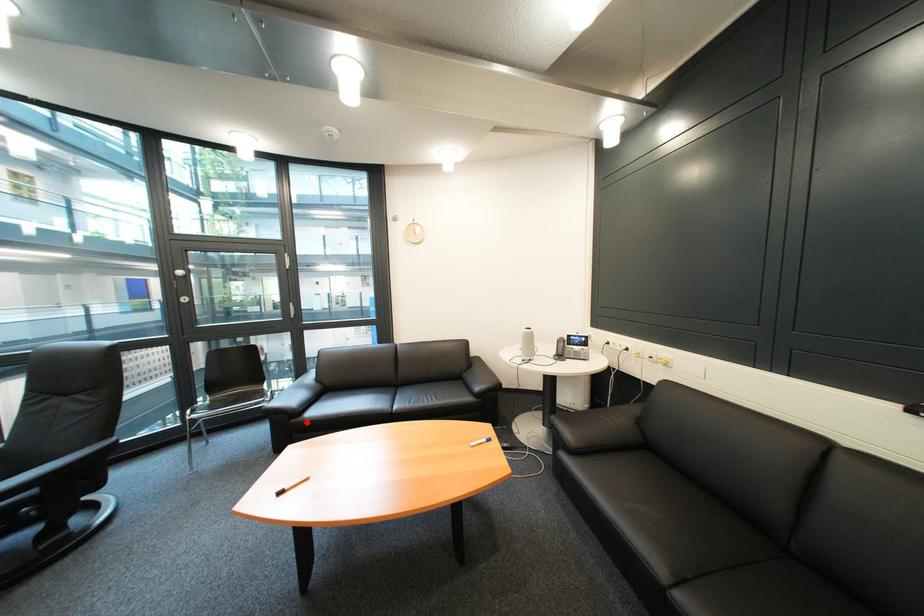
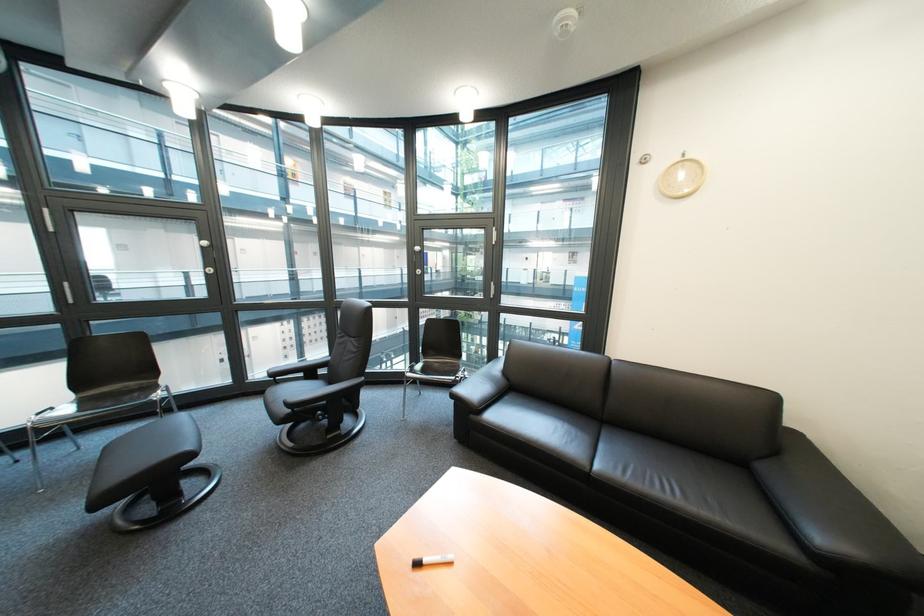
Question: I am providing you with two images of the same scene from different viewpoints. Image1 has a red point marked. In image2, the corresponding 3D location appears at what relative position? Reply with the corresponding letter.

Choices:
 (A) Closer
 (B) Farther

Answer: (B)